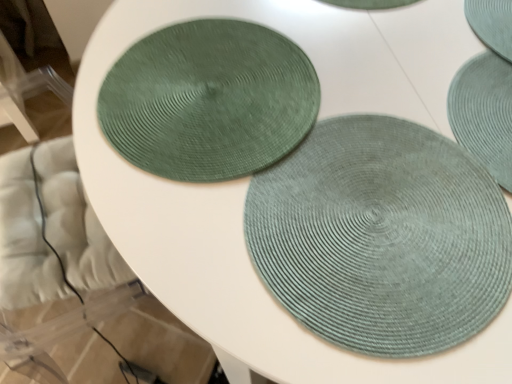
The image size is (512, 384). What are the coordinates of `vacant space that is in between green woven coaster at upper left, the 1th coaster when ordered from left to right, and teal woven coaster at upper right, positioned as the 2th coaster in left-to-right order` in the screenshot? It's located at (389, 63).